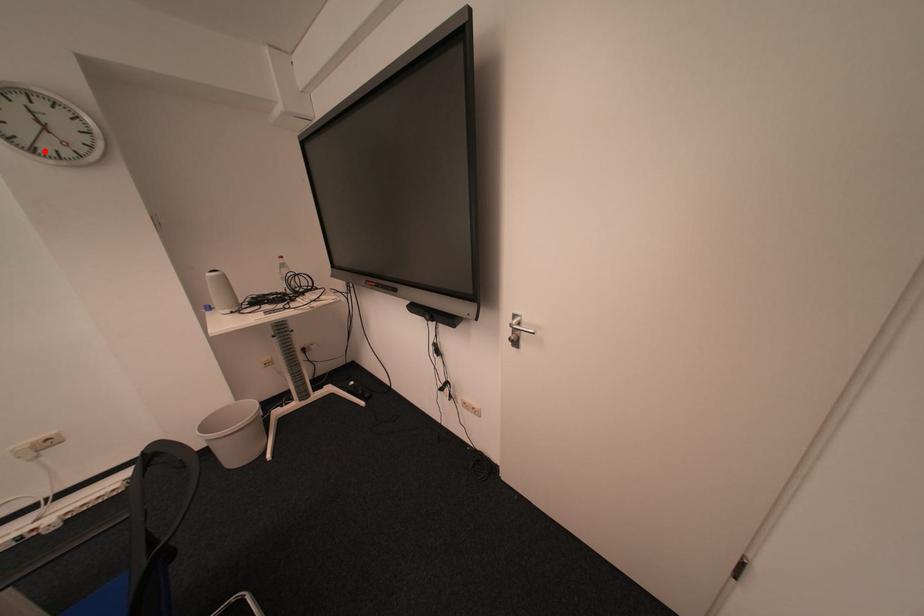
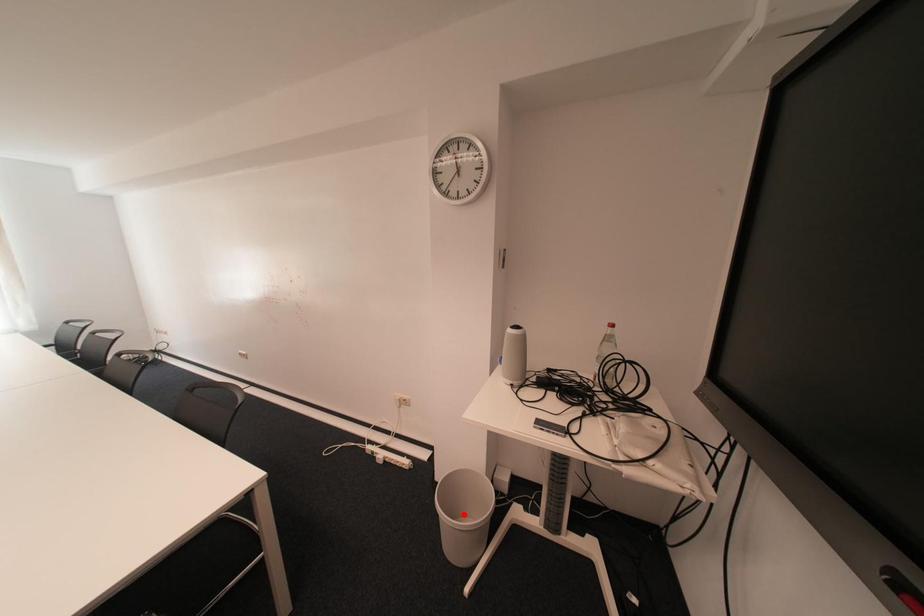
I am providing you with two images of the same scene from different viewpoints. A red point is marked on the first image and another point is marked on the second image. Are the points marked in image1 and image2 representing the same 3D position?

No